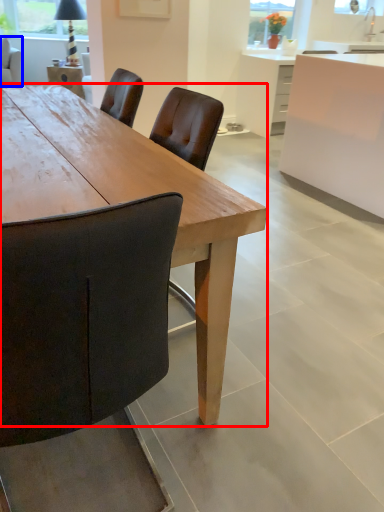
Question: Which of the following is the farthest to the observer, desk (highlighted by a red box) or chair (highlighted by a blue box)?

Choices:
 (A) desk
 (B) chair

Answer: (B)